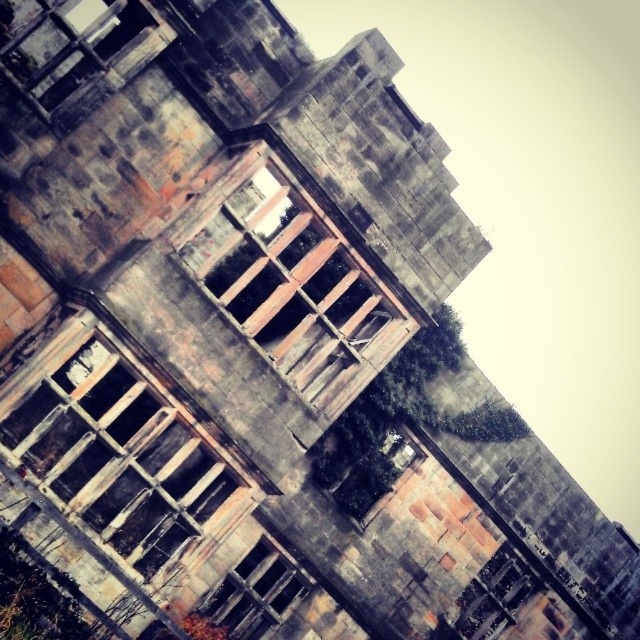
You are a contractor assessing the structural integrity of the building. You notice the wooden frame window at lower left and the rusty metal window at center. Which window would require more material to repair due to its size?

The wooden frame window at lower left requires more material to repair because it is larger in size than the rusty metal window at center.